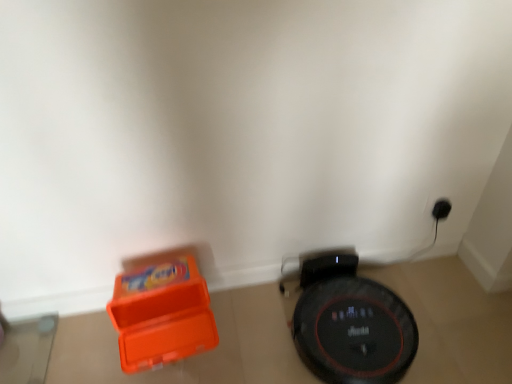
Question: Would you say orange plastic toy at lower left is inside or outside black glossy robot vacuum cleaner at lower right?

Choices:
 (A) outside
 (B) inside

Answer: (A)

Question: Considering the positions of point (158, 336) and point (352, 294), is point (158, 336) closer or farther from the camera than point (352, 294)?

Choices:
 (A) farther
 (B) closer

Answer: (B)

Question: Considering the positions of orange plastic toy at lower left and black glossy robot vacuum cleaner at lower right in the image, is orange plastic toy at lower left bigger or smaller than black glossy robot vacuum cleaner at lower right?

Choices:
 (A) small
 (B) big

Answer: (A)

Question: Is black glossy robot vacuum cleaner at lower right in front of or behind orange plastic toy at lower left in the image?

Choices:
 (A) front
 (B) behind

Answer: (B)

Question: From the image's perspective, is black glossy robot vacuum cleaner at lower right positioned above or below orange plastic toy at lower left?

Choices:
 (A) below
 (B) above

Answer: (A)

Question: Is black glossy robot vacuum cleaner at lower right wider or thinner than orange plastic toy at lower left?

Choices:
 (A) wide
 (B) thin

Answer: (A)

Question: Is point (330, 375) positioned closer to the camera than point (139, 294)?

Choices:
 (A) closer
 (B) farther

Answer: (A)